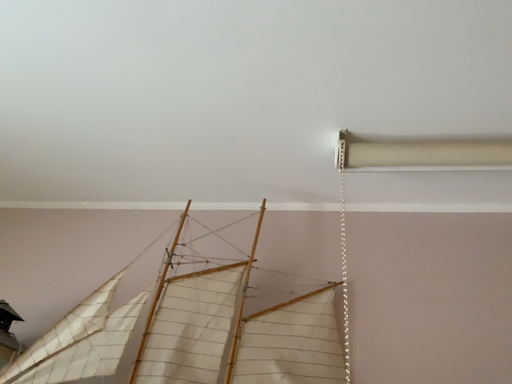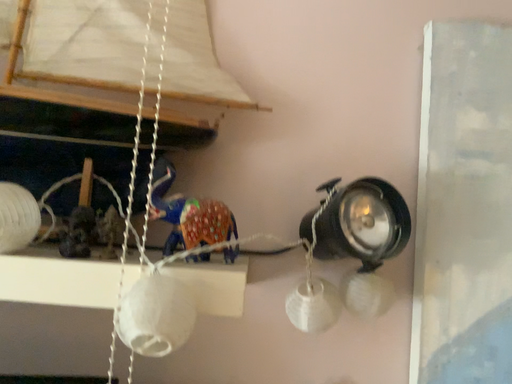
Question: How did the camera likely rotate when shooting the video?

Choices:
 (A) rotated upward
 (B) rotated downward

Answer: (B)